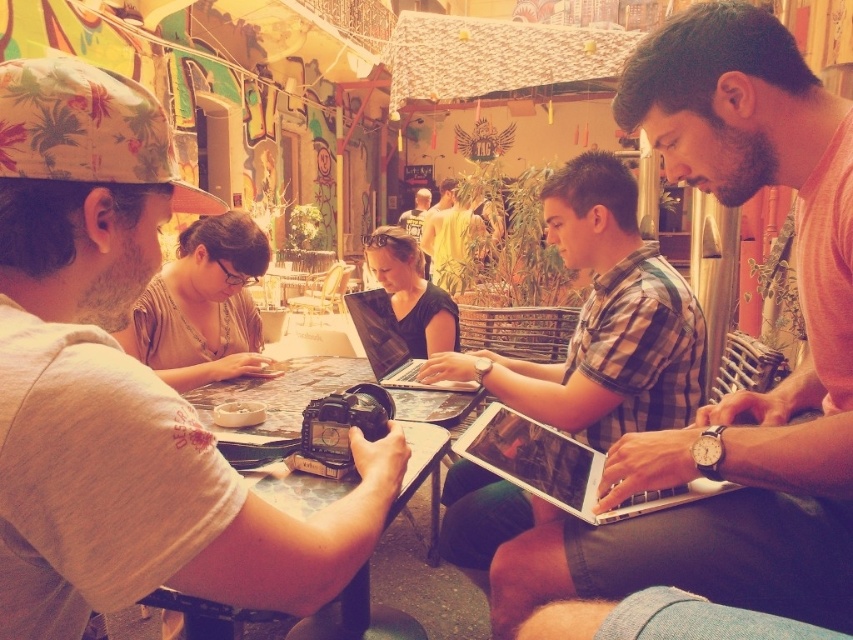
Does silver metallic laptop at center come behind yellow matte shirt at center?

That is False.

Does silver metallic laptop at center have a greater width compared to yellow matte shirt at center?

Incorrect, silver metallic laptop at center's width does not surpass yellow matte shirt at center's.

Is point (502, 410) farther from camera compared to point (430, 269)?

No, it is in front of (430, 269).

Where is `silver metallic laptop at center`? The width and height of the screenshot is (853, 640). silver metallic laptop at center is located at coordinates (561, 467).

Which is more to the right, black glossy laptop at center or yellow matte shirt at center?

yellow matte shirt at center

Does black glossy laptop at center have a smaller size compared to yellow matte shirt at center?

Indeed, black glossy laptop at center has a smaller size compared to yellow matte shirt at center.

Does point (363, 294) come behind point (477, 216)?

No.

Locate an element on the screen. This screenshot has height=640, width=853. black glossy laptop at center is located at coordinates (392, 342).

Between beige cotton shirt at left and checkered fabric shirt at center, which one appears on the right side from the viewer's perspective?

Positioned to the right is checkered fabric shirt at center.

Does point (38, 506) come in front of point (624, 355)?

Yes, point (38, 506) is in front of point (624, 355).

Where is `beige cotton shirt at left`? beige cotton shirt at left is located at coordinates (125, 387).